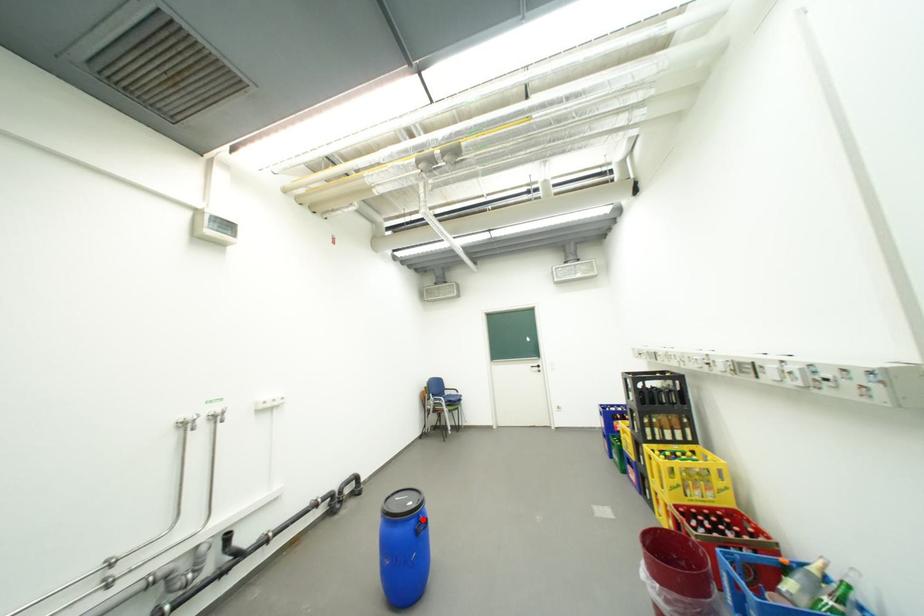
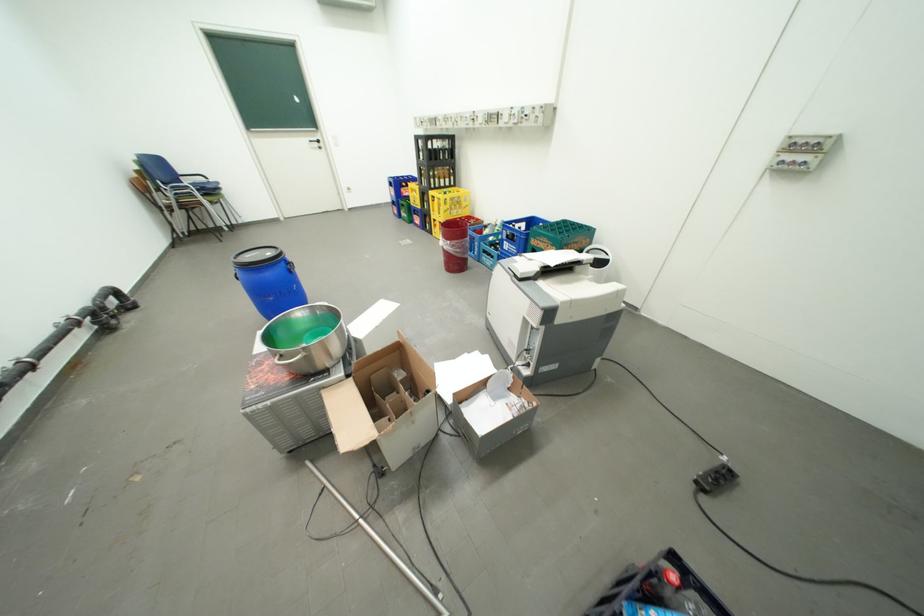
Where in the second image is the point corresponding to the highlighted location from the first image?

(290, 262)